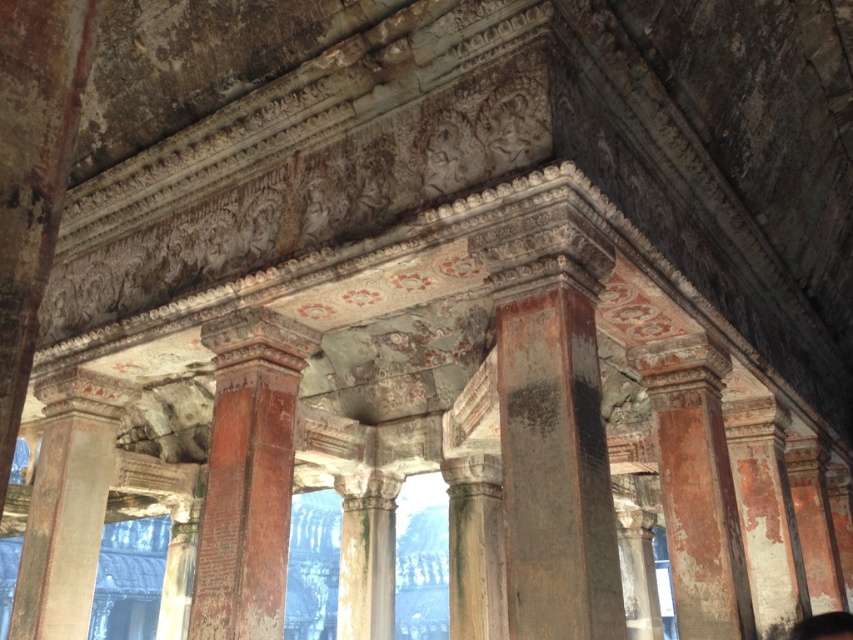
Question: Can you confirm if rusty metal column at center is thinner than rusty stone column at center?

Choices:
 (A) yes
 (B) no

Answer: (B)

Question: In this image, where is rusty metal column at center located relative to rustic stone column at center?

Choices:
 (A) left
 (B) right

Answer: (A)

Question: Which object appears farthest from the camera in this image?

Choices:
 (A) rusty stone column at center
 (B) rusty metal column at center
 (C) rustic stone column at center

Answer: (C)

Question: Which of the following is the closest to the observer?

Choices:
 (A) rusty stone column at center
 (B) rustic stone column at center

Answer: (A)

Question: Among these objects, which one is farthest from the camera?

Choices:
 (A) rusty metal column at center
 (B) rustic stone column at center
 (C) rusty stone column at center

Answer: (B)

Question: Can you confirm if rusty metal column at center is positioned above rustic stone column at center?

Choices:
 (A) yes
 (B) no

Answer: (A)